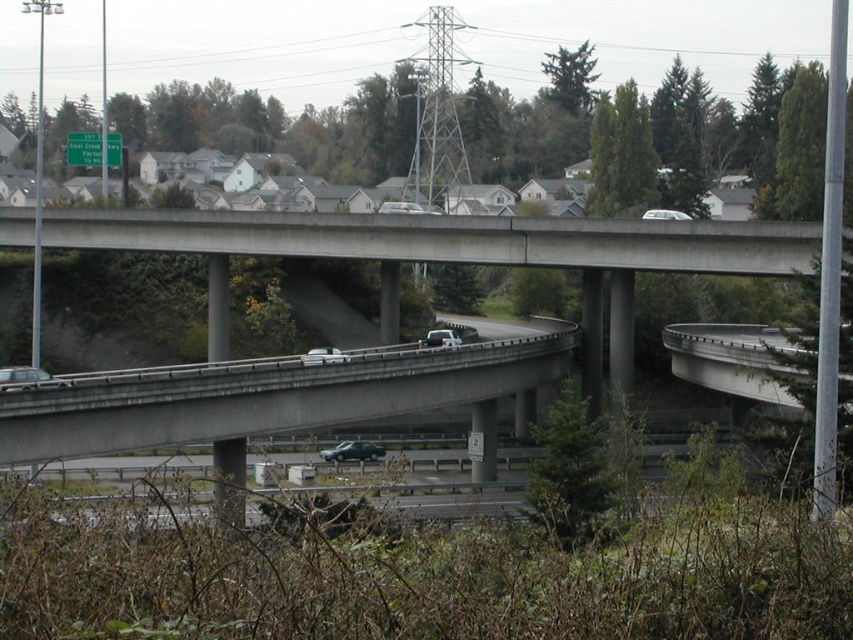
You are a delivery driver needing to park your vehicle in a tight space between two other cars. You see the silver metallic sedan at lower left and the white matte sedan at center. Which car should you avoid parking next to if you want to leave more space for maneuvering?

You should avoid parking next to the silver metallic sedan at lower left because it is shorter than the white matte sedan at center, leaving less space for maneuvering.